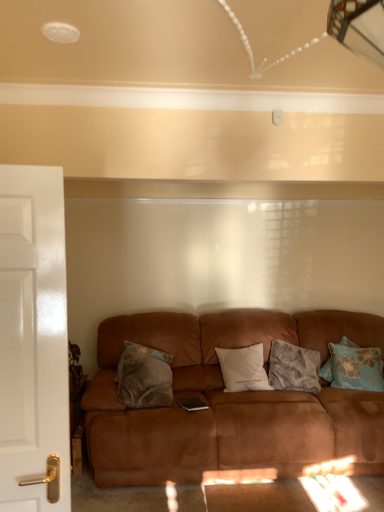
Describe the element at coordinates (243, 368) in the screenshot. This screenshot has height=512, width=384. I see `white soft cushion at center, acting as the 2th pillow starting from the left` at that location.

The image size is (384, 512). Find the location of `white soft cushion at center, the 3th pillow viewed from the right`. white soft cushion at center, the 3th pillow viewed from the right is located at coordinates (243, 368).

The image size is (384, 512). What do you see at coordinates (33, 338) in the screenshot?
I see `white glossy door at left` at bounding box center [33, 338].

Where is `blue floral pillow at right, the 4th pillow positioned from the left`? The image size is (384, 512). blue floral pillow at right, the 4th pillow positioned from the left is located at coordinates (353, 367).

Find the location of a particular element. This screenshot has height=512, width=384. fluffy brown pillow at center, the fourth pillow in the right-to-left sequence is located at coordinates (141, 353).

Identify the location of white soft cushion at center, acting as the 2th pillow starting from the left. Image resolution: width=384 pixels, height=512 pixels. (243, 368).

Which point is more distant from viewer, (x=291, y=374) or (x=186, y=472)?

Point (x=291, y=374)

How different are the orientations of fluffy gray pillow at center, the third pillow positioned from the left, and suede brown couch at center in degrees?

The angle between the facing direction of fluffy gray pillow at center, the third pillow positioned from the left, and the facing direction of suede brown couch at center is 10 degrees.

This screenshot has width=384, height=512. I want to click on pillow that is the 1st one above the suede brown couch at center (from a real-world perspective), so click(294, 367).

From a real-world perspective, between fluffy gray pillow at center, the second pillow from the right, and suede brown couch at center, who is vertically higher?

In real-world perspective, fluffy gray pillow at center, the second pillow from the right, is above.

Is fluffy gray pillow at center, the second pillow from the right, looking in the opposite direction of fluffy brown pillow at center, the fourth pillow in the right-to-left sequence?

No, fluffy brown pillow at center, the fourth pillow in the right-to-left sequence, is not at the back of fluffy gray pillow at center, the second pillow from the right.

Is fluffy gray pillow at center, the third pillow positioned from the left, in front of or behind fluffy brown pillow at center, the fourth pillow in the right-to-left sequence, in the image?

Visually, fluffy gray pillow at center, the third pillow positioned from the left, is located in front of fluffy brown pillow at center, the fourth pillow in the right-to-left sequence.

Is fluffy gray pillow at center, the third pillow positioned from the left, in contact with fluffy brown pillow at center, the fourth pillow in the right-to-left sequence?

No, fluffy gray pillow at center, the third pillow positioned from the left, is not next to fluffy brown pillow at center, the fourth pillow in the right-to-left sequence.

Can fluffy brown pillow at center, the fourth pillow in the right-to-left sequence, be found inside fluffy gray pillow at center, the second pillow from the right?

No, fluffy gray pillow at center, the second pillow from the right, does not contain fluffy brown pillow at center, the fourth pillow in the right-to-left sequence.

Is fluffy gray pillow at center, the second pillow from the right, next to white glossy door at left and touching it?

No.

Does fluffy gray pillow at center, the third pillow positioned from the left, contain white glossy door at left?

Actually, white glossy door at left is outside fluffy gray pillow at center, the third pillow positioned from the left.

Between fluffy gray pillow at center, the third pillow positioned from the left, and white glossy door at left, which one appears on the right side from the viewer's perspective?

fluffy gray pillow at center, the third pillow positioned from the left.

Considering the relative sizes of fluffy gray pillow at center, the second pillow from the right, and white glossy door at left in the image provided, is fluffy gray pillow at center, the second pillow from the right, smaller than white glossy door at left?

No.

Does fluffy gray pillow at center, the second pillow from the right, have a greater height compared to blue floral pillow at right, the 4th pillow positioned from the left?

Yes, fluffy gray pillow at center, the second pillow from the right, is taller than blue floral pillow at right, the 4th pillow positioned from the left.

Is fluffy gray pillow at center, the third pillow positioned from the left, beside blue floral pillow at right, the 4th pillow positioned from the left?

No, fluffy gray pillow at center, the third pillow positioned from the left, is not touching blue floral pillow at right, the 4th pillow positioned from the left.

You are a GUI agent. You are given a task and a screenshot of the screen. Output one action in this format:
    pyautogui.click(x=<x>, y=<y>)
    Task: Click on the pillow on the right of fluffy gray pillow at center, the third pillow positioned from the left
    This screenshot has width=384, height=512.
    Given the screenshot: What is the action you would take?
    pyautogui.click(x=353, y=367)

Considering the sizes of fluffy gray pillow at center, the second pillow from the right, and blue floral pillow at right, the 1th pillow when ordered from right to left, in the image, is fluffy gray pillow at center, the second pillow from the right, wider or thinner than blue floral pillow at right, the 1th pillow when ordered from right to left,?

In the image, fluffy gray pillow at center, the second pillow from the right, appears to be wider than blue floral pillow at right, the 1th pillow when ordered from right to left.

From the image's perspective, is white soft cushion at center, acting as the 2th pillow starting from the left, located above or below fluffy gray pillow at center, the second pillow from the right?

white soft cushion at center, acting as the 2th pillow starting from the left, is situated higher than fluffy gray pillow at center, the second pillow from the right, in the image.

Between point (226, 365) and point (291, 355), which one is positioned behind?

The point (291, 355) is farther.

From a real-world perspective, which object rests below the other?

In real-world perspective, fluffy gray pillow at center, the third pillow positioned from the left, is lower.

Which is behind, point (359, 375) or point (179, 454)?

The point (359, 375) is more distant.

Measure the distance from blue floral pillow at right, the 4th pillow positioned from the left, to suede brown couch at center.

blue floral pillow at right, the 4th pillow positioned from the left, and suede brown couch at center are 25.93 inches apart.

Would you say suede brown couch at center is part of blue floral pillow at right, the 4th pillow positioned from the left,'s contents?

No.

Based on the photo, does blue floral pillow at right, the 1th pillow when ordered from right to left, appear on the left side of suede brown couch at center?

Incorrect, blue floral pillow at right, the 1th pillow when ordered from right to left, is not on the left side of suede brown couch at center.

Between fluffy brown pillow at center, the fourth pillow in the right-to-left sequence, and white glossy door at left, which one has more height?

white glossy door at left is taller.

Is fluffy brown pillow at center, which is counted as the first pillow, starting from the left, to the left or to the right of white glossy door at left in the image?

fluffy brown pillow at center, which is counted as the first pillow, starting from the left, is to the right of white glossy door at left.

Considering the sizes of objects fluffy brown pillow at center, the fourth pillow in the right-to-left sequence, and white glossy door at left in the image provided, who is smaller, fluffy brown pillow at center, the fourth pillow in the right-to-left sequence, or white glossy door at left?

Smaller between the two is fluffy brown pillow at center, the fourth pillow in the right-to-left sequence.

Locate an element on the screen. The image size is (384, 512). pillow that is the 3rd object located behind the suede brown couch at center is located at coordinates (294, 367).

Image resolution: width=384 pixels, height=512 pixels. What are the coordinates of `the 3rd pillow above when counting from the fluffy gray pillow at center, the second pillow from the right (from the image's perspective)` in the screenshot? It's located at (141, 353).

Which object lies further to the anchor point suede brown couch at center, white glossy door at left or fluffy brown pillow at center, the fourth pillow in the right-to-left sequence?

white glossy door at left.

Considering their positions, is fluffy gray pillow at center, the third pillow positioned from the left, positioned further to white soft cushion at center, acting as the 2th pillow starting from the left, than suede brown couch at center?

suede brown couch at center lies further to white soft cushion at center, acting as the 2th pillow starting from the left, than the other object.

Which object lies further to the anchor point fluffy gray pillow at center, the second pillow from the right, white glossy door at left or white soft cushion at center, acting as the 2th pillow starting from the left?

Based on the image, white glossy door at left appears to be further to fluffy gray pillow at center, the second pillow from the right.

When comparing their distances from fluffy gray pillow at center, the third pillow positioned from the left, does white soft cushion at center, the 3th pillow viewed from the right, or suede brown couch at center seem closer?

white soft cushion at center, the 3th pillow viewed from the right, lies closer to fluffy gray pillow at center, the third pillow positioned from the left, than the other object.

From the image, which object appears to be farther from white soft cushion at center, the 3th pillow viewed from the right, blue floral pillow at right, the 4th pillow positioned from the left, or fluffy brown pillow at center, which is counted as the first pillow, starting from the left?

blue floral pillow at right, the 4th pillow positioned from the left, lies further to white soft cushion at center, the 3th pillow viewed from the right, than the other object.

Estimate the real-world distances between objects in this image. Which object is further from fluffy gray pillow at center, the third pillow positioned from the left, white glossy door at left or suede brown couch at center?

white glossy door at left lies further to fluffy gray pillow at center, the third pillow positioned from the left, than the other object.

Looking at the image, which one is located closer to white soft cushion at center, acting as the 2th pillow starting from the left, fluffy brown pillow at center, which is counted as the first pillow, starting from the left, or fluffy gray pillow at center, the third pillow positioned from the left?

fluffy gray pillow at center, the third pillow positioned from the left.

Looking at the image, which one is located closer to suede brown couch at center, fluffy gray pillow at center, the second pillow from the right, or white soft cushion at center, acting as the 2th pillow starting from the left?

white soft cushion at center, acting as the 2th pillow starting from the left, is positioned closer to the anchor suede brown couch at center.

In order to click on studio couch between white glossy door at left and fluffy brown pillow at center, which is counted as the first pillow, starting from the left, in the front-back direction in this screenshot , I will do `click(229, 401)`.

Image resolution: width=384 pixels, height=512 pixels. Find the location of `studio couch between fluffy brown pillow at center, the fourth pillow in the right-to-left sequence, and blue floral pillow at right, the 1th pillow when ordered from right to left, from left to right`. studio couch between fluffy brown pillow at center, the fourth pillow in the right-to-left sequence, and blue floral pillow at right, the 1th pillow when ordered from right to left, from left to right is located at coordinates (229, 401).

Find the location of `studio couch between white glossy door at left and fluffy gray pillow at center, the third pillow positioned from the left, in the front-back direction`. studio couch between white glossy door at left and fluffy gray pillow at center, the third pillow positioned from the left, in the front-back direction is located at coordinates (229, 401).

This screenshot has width=384, height=512. I want to click on studio couch located between white soft cushion at center, acting as the 2th pillow starting from the left, and blue floral pillow at right, the 1th pillow when ordered from right to left, in the left-right direction, so click(x=229, y=401).